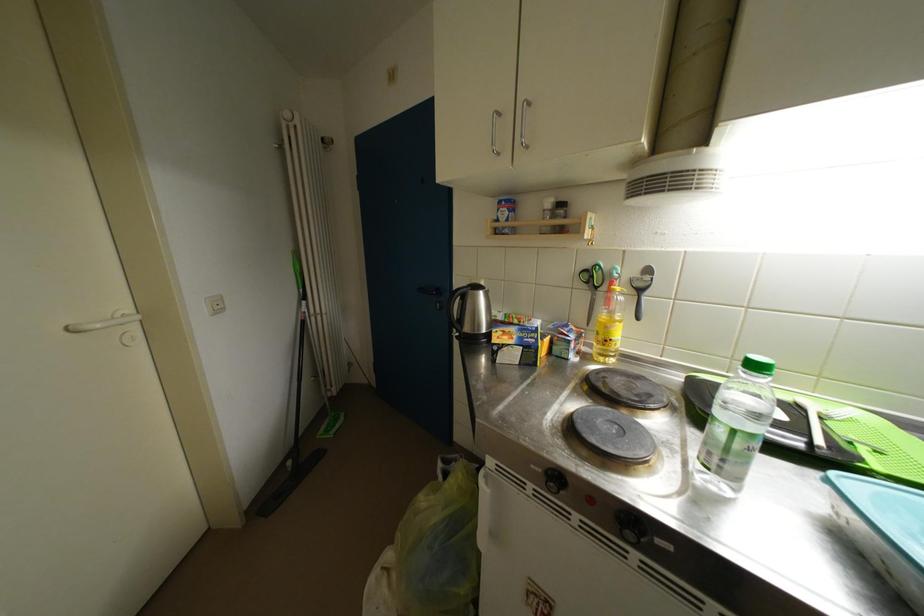
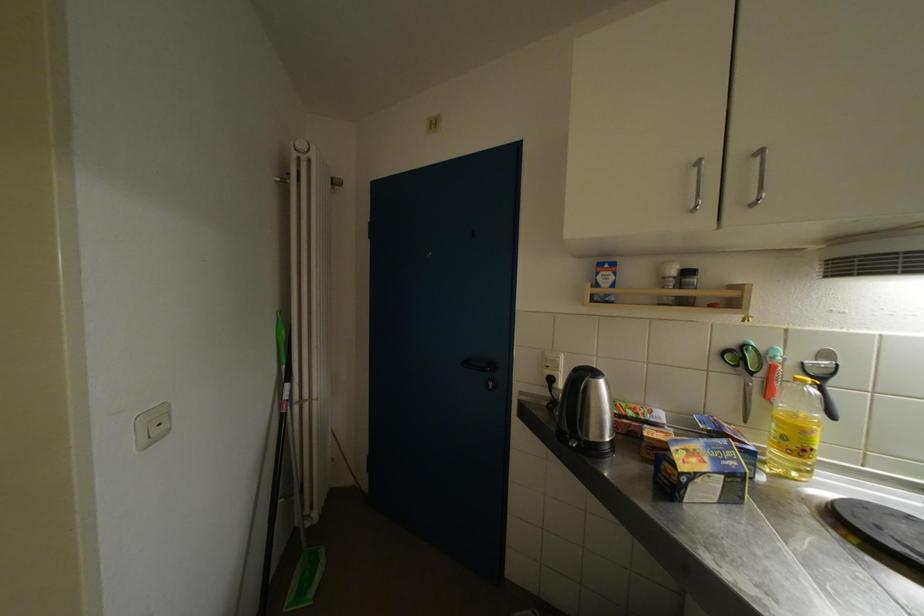
Consider the image. What movement of the cameraman would produce the second image?

The cameraman walked toward left, forward.